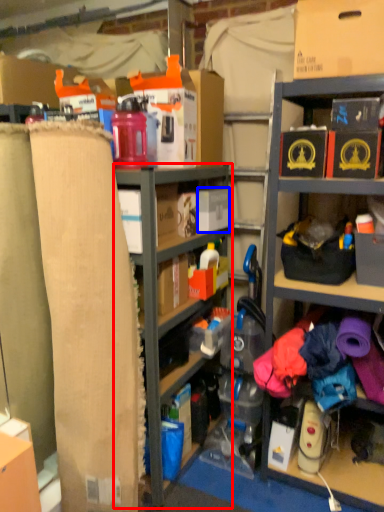
Question: Which point is closer to the camera, shelf (highlighted by a red box) or storage box (highlighted by a blue box)?

Choices:
 (A) shelf
 (B) storage box

Answer: (A)